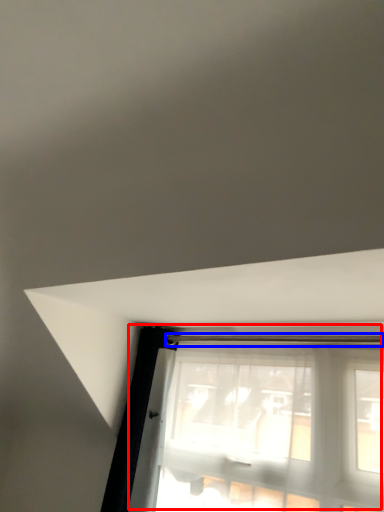
Question: Among these objects, which one is nearest to the camera, window (highlighted by a red box) or beam (highlighted by a blue box)?

Choices:
 (A) window
 (B) beam

Answer: (A)